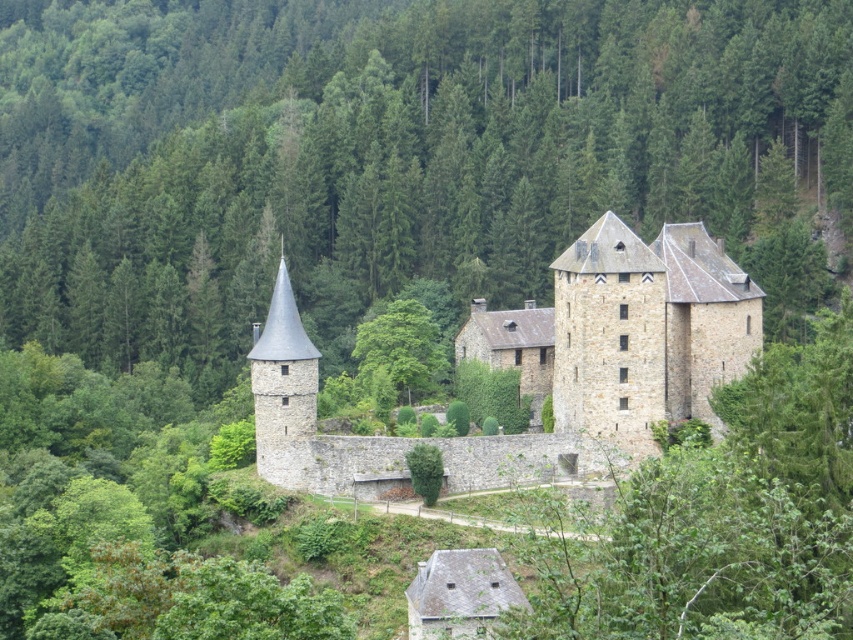
Is green leafy tree at center behind stone castle at center?

Yes.

Is green leafy tree at center shorter than stone castle at center?

Incorrect, green leafy tree at center's height does not fall short of stone castle at center's.

Which is behind, point (820, 296) or point (305, 451)?

Point (820, 296)

In order to click on green leafy tree at center in this screenshot , I will do `click(451, 173)`.

Can you confirm if stone castle at center is positioned to the right of stone spire at left?

Indeed, stone castle at center is positioned on the right side of stone spire at left.

Between stone castle at center and stone spire at left, which one is positioned lower?

stone castle at center

Identify the location of stone castle at center. (614, 352).

Where is `stone castle at center`? The width and height of the screenshot is (853, 640). stone castle at center is located at coordinates (614, 352).

Based on the photo, which of these two, green leafy tree at center or stone spire at left, stands shorter?

stone spire at left

Who is taller, green leafy tree at center or stone spire at left?

With more height is green leafy tree at center.

Locate an element on the screen. This screenshot has width=853, height=640. green leafy tree at center is located at coordinates (451, 173).